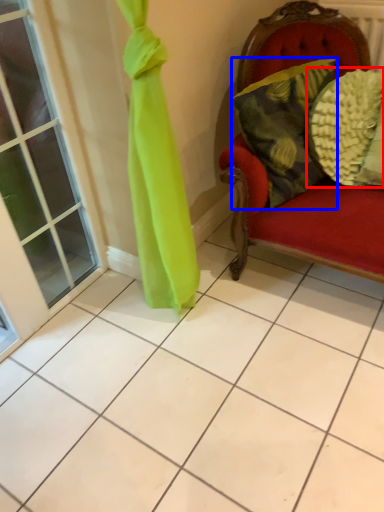
Question: Which object is closer to the camera taking this photo, pillow (highlighted by a red box) or pillow (highlighted by a blue box)?

Choices:
 (A) pillow
 (B) pillow

Answer: (B)